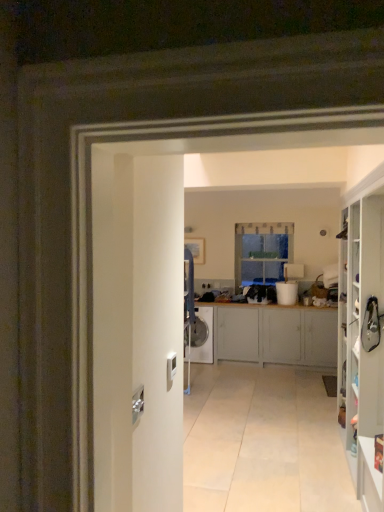
Question: Considering the relative sizes of white glossy washing machine at center and clear glass window at center in the image provided, is white glossy washing machine at center wider than clear glass window at center?

Choices:
 (A) no
 (B) yes

Answer: (B)

Question: Can you confirm if white glossy washing machine at center is taller than clear glass window at center?

Choices:
 (A) yes
 (B) no

Answer: (B)

Question: From the image's perspective, is white glossy washing machine at center located beneath clear glass window at center?

Choices:
 (A) yes
 (B) no

Answer: (A)

Question: Does white glossy washing machine at center turn towards clear glass window at center?

Choices:
 (A) no
 (B) yes

Answer: (A)

Question: From a real-world perspective, is white glossy washing machine at center over clear glass window at center?

Choices:
 (A) yes
 (B) no

Answer: (B)

Question: In the image, is white glossy cabinet at right, which is the first cabinetry in front-to-back order, on the left side or the right side of matte gray cabinet at center, which is counted as the 1th cabinetry, starting from the back?

Choices:
 (A) left
 (B) right

Answer: (B)

Question: Looking at their shapes, would you say white glossy cabinet at right, the second cabinetry viewed from the back, is wider or thinner than matte gray cabinet at center, which is counted as the 1th cabinetry, starting from the back?

Choices:
 (A) wide
 (B) thin

Answer: (B)

Question: In the image, is white glossy cabinet at right, which is the first cabinetry in front-to-back order, positioned in front of or behind matte gray cabinet at center, positioned as the 2th cabinetry in front-to-back order?

Choices:
 (A) behind
 (B) front

Answer: (B)

Question: From a real-world perspective, is white glossy cabinet at right, the second cabinetry viewed from the back, physically located above or below matte gray cabinet at center, which is counted as the 1th cabinetry, starting from the back?

Choices:
 (A) above
 (B) below

Answer: (A)

Question: From the image's perspective, is matte gray cabinet at center, positioned as the 2th cabinetry in front-to-back order, above or below white glossy cabinet at right, which is the first cabinetry in front-to-back order?

Choices:
 (A) above
 (B) below

Answer: (B)

Question: Relative to white glossy cabinet at right, the second cabinetry viewed from the back, is matte gray cabinet at center, positioned as the 2th cabinetry in front-to-back order, in front or behind?

Choices:
 (A) behind
 (B) front

Answer: (A)

Question: Is matte gray cabinet at center, positioned as the 2th cabinetry in front-to-back order, wider or thinner than white glossy cabinet at right, which is the first cabinetry in front-to-back order?

Choices:
 (A) thin
 (B) wide

Answer: (B)

Question: In terms of size, does matte gray cabinet at center, which is counted as the 1th cabinetry, starting from the back, appear bigger or smaller than white glossy cabinet at right, the second cabinetry viewed from the back?

Choices:
 (A) small
 (B) big

Answer: (A)

Question: Considering the relative positions of clear glass window at center and white glossy washing machine at center in the image provided, is clear glass window at center to the left or to the right of white glossy washing machine at center?

Choices:
 (A) left
 (B) right

Answer: (B)

Question: Is clear glass window at center taller or shorter than white glossy washing machine at center?

Choices:
 (A) short
 (B) tall

Answer: (B)